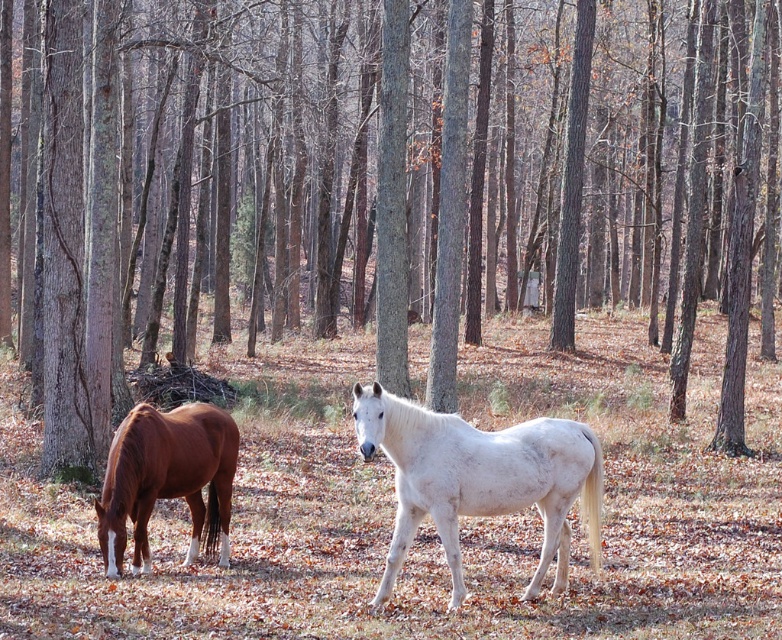
Question: Which of the following is the farthest from the observer?

Choices:
 (A) brown glossy horse at left
 (B) white matte horse at center

Answer: (A)

Question: Which point is closer to the camera?

Choices:
 (A) (361, 388)
 (B) (488, 349)

Answer: (A)

Question: Which of these objects is positioned farthest from the brown grass at center?

Choices:
 (A) brown glossy horse at left
 (B) white matte horse at center

Answer: (A)

Question: Can you confirm if brown grass at center is positioned to the left of brown glossy horse at left?

Choices:
 (A) yes
 (B) no

Answer: (B)

Question: Does brown grass at center have a greater width compared to brown glossy horse at left?

Choices:
 (A) no
 (B) yes

Answer: (B)

Question: Is brown grass at center positioned before white matte horse at center?

Choices:
 (A) no
 (B) yes

Answer: (B)